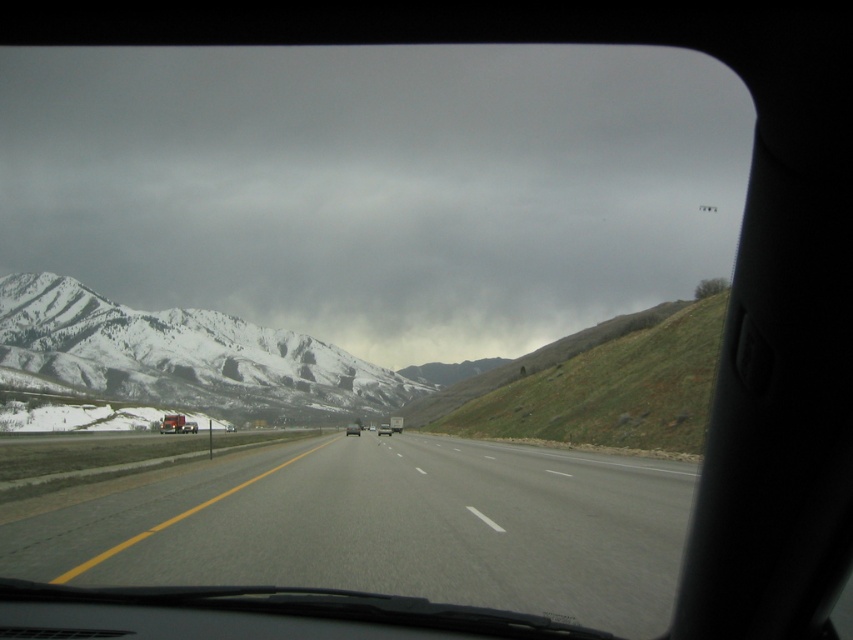
Question: Is snowy rocky mountain at left to the right of metallic silver truck at left from the viewer's perspective?

Choices:
 (A) no
 (B) yes

Answer: (A)

Question: Which point is farther to the camera?

Choices:
 (A) metallic silver truck at left
 (B) silver metallic sedan at center

Answer: (B)

Question: Which of the following is the closest to the observer?

Choices:
 (A) silver metallic truck at center
 (B) gray cloudy sky at upper center
 (C) metallic silver truck at left

Answer: (C)

Question: Which point is closer to the camera?

Choices:
 (A) (194, 378)
 (B) (167, 420)
 (C) (364, 84)

Answer: (B)

Question: Does gray cloudy sky at upper center appear on the right side of metallic silver truck at left?

Choices:
 (A) no
 (B) yes

Answer: (B)

Question: Is gray cloudy sky at upper center to the left of metallic silver truck at left from the viewer's perspective?

Choices:
 (A) yes
 (B) no

Answer: (B)